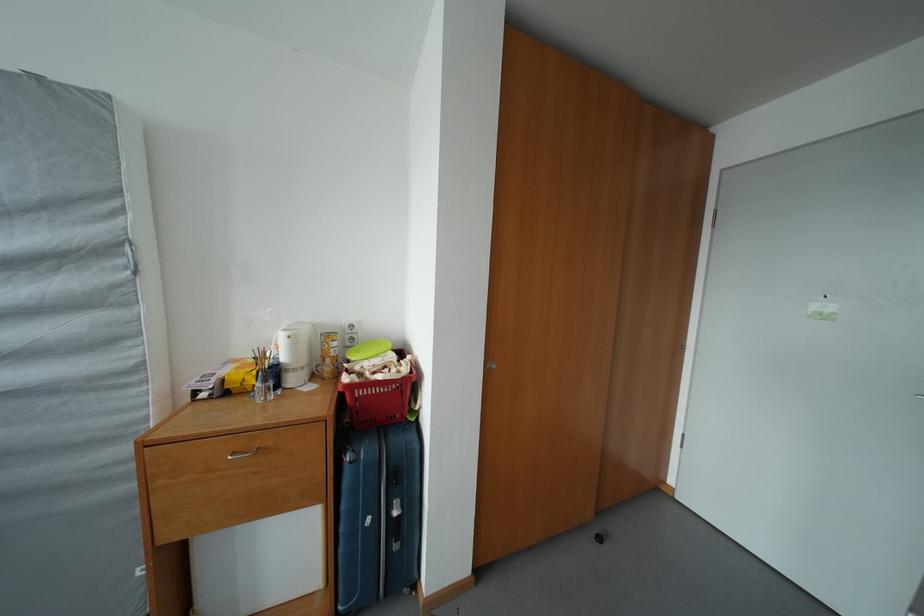
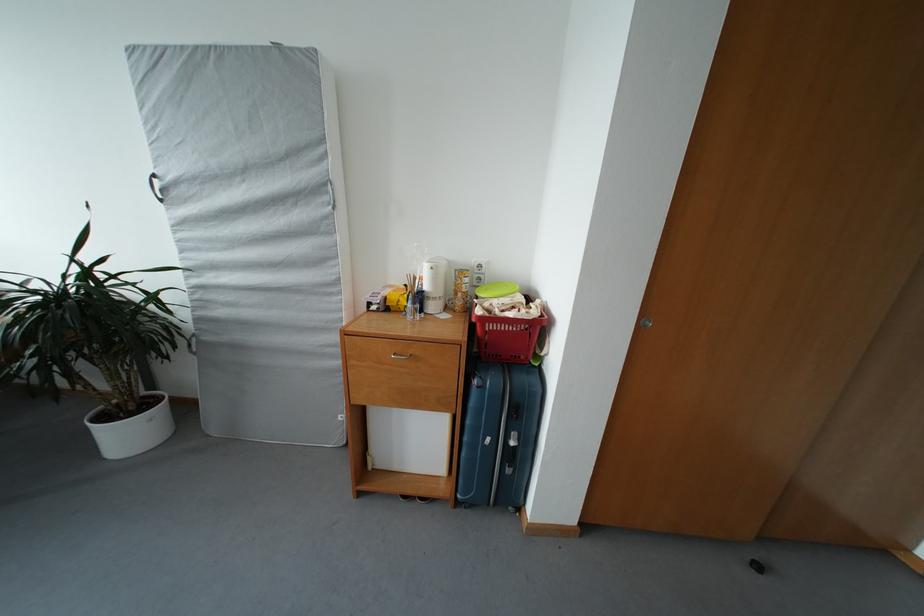
Where in the second image is the point corresponding to point (359, 344) from the first image?

(485, 284)